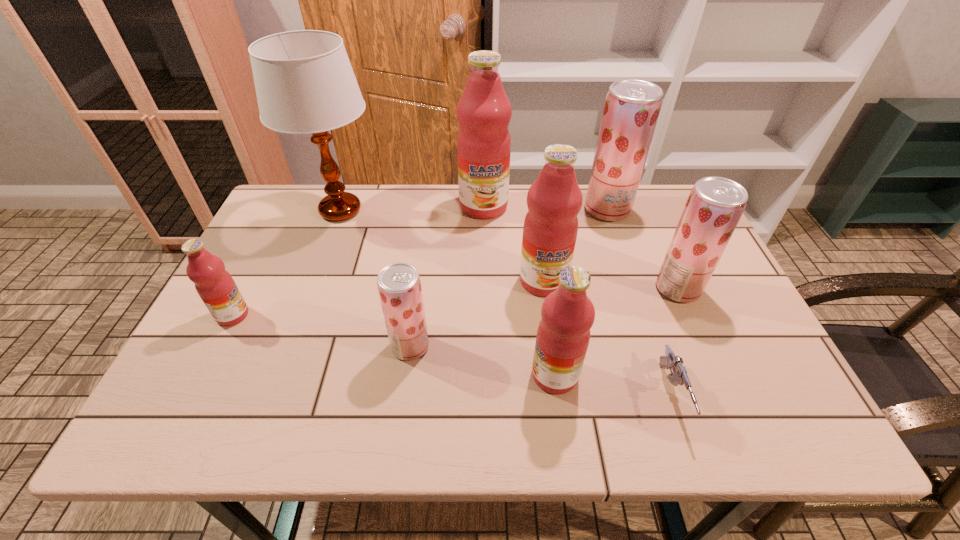
Image resolution: width=960 pixels, height=540 pixels. Find the location of `vacant space at the right edge`. vacant space at the right edge is located at coordinates pyautogui.click(x=778, y=394).

Identify the location of vacant area at the far left corner of the desktop. (299, 205).

I want to click on vacant space at the near left corner, so click(189, 424).

What are the coordinates of `vacant area at the far right corner of the desktop` in the screenshot? It's located at (643, 227).

Identify the location of free space that is in between the smallest pink fruit juice and the shortest object. (452, 355).

Image resolution: width=960 pixels, height=540 pixels. In order to click on vacant area that lies between the table lamp and the gun in this screenshot , I will do `click(506, 303)`.

Identify the location of free space that is in between the sixth fruit juice from right to left and the leftmost pink fruit juice. This screenshot has width=960, height=540. (322, 330).

Image resolution: width=960 pixels, height=540 pixels. I want to click on empty space that is in between the smallest pink fruit juice and the gun, so click(x=452, y=355).

At what (x,y) coordinates should I click in order to perform the action: click on empty location between the gun and the table lamp. Please return your answer as a coordinate pair (x, y). The width and height of the screenshot is (960, 540). Looking at the image, I should click on (506, 303).

Where is `empty space that is in between the third farthest pink fruit juice and the biggest strawberry fruit juice`? The image size is (960, 540). empty space that is in between the third farthest pink fruit juice and the biggest strawberry fruit juice is located at coordinates (420, 262).